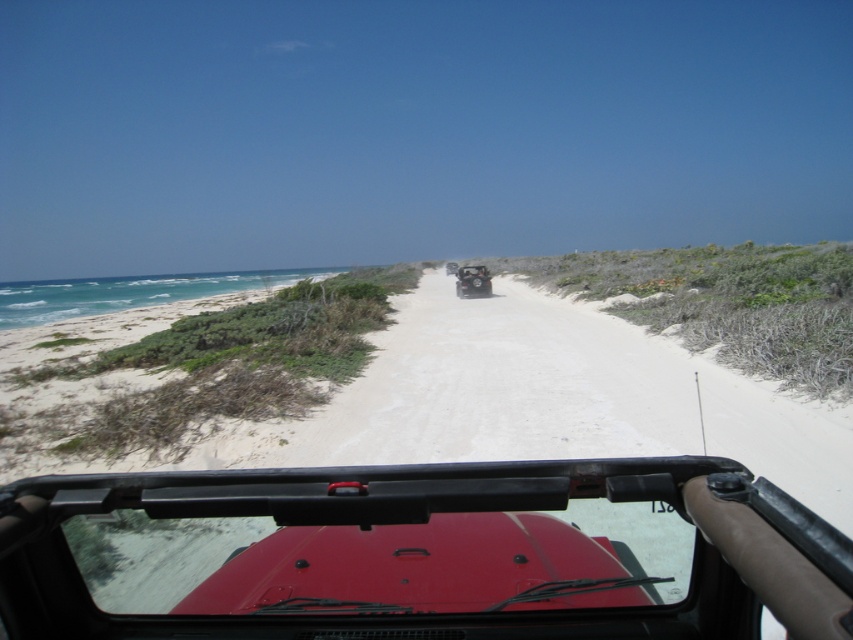
Question: Which point is farther to the camera?

Choices:
 (A) (480, 292)
 (B) (235, 628)

Answer: (A)

Question: Can you confirm if matte red jeep at center is wider than matte black jeep at center?

Choices:
 (A) yes
 (B) no

Answer: (B)

Question: Can you confirm if matte red car at center is positioned to the right of matte red jeep at center?

Choices:
 (A) yes
 (B) no

Answer: (B)

Question: Which of these objects is positioned closest to the matte red jeep at center?

Choices:
 (A) matte red car at center
 (B) matte black jeep at center

Answer: (A)

Question: Is matte red jeep at center further to the viewer compared to matte black jeep at center?

Choices:
 (A) yes
 (B) no

Answer: (B)

Question: Considering the real-world distances, which object is closest to the matte black jeep at center?

Choices:
 (A) matte red car at center
 (B) matte red jeep at center

Answer: (B)